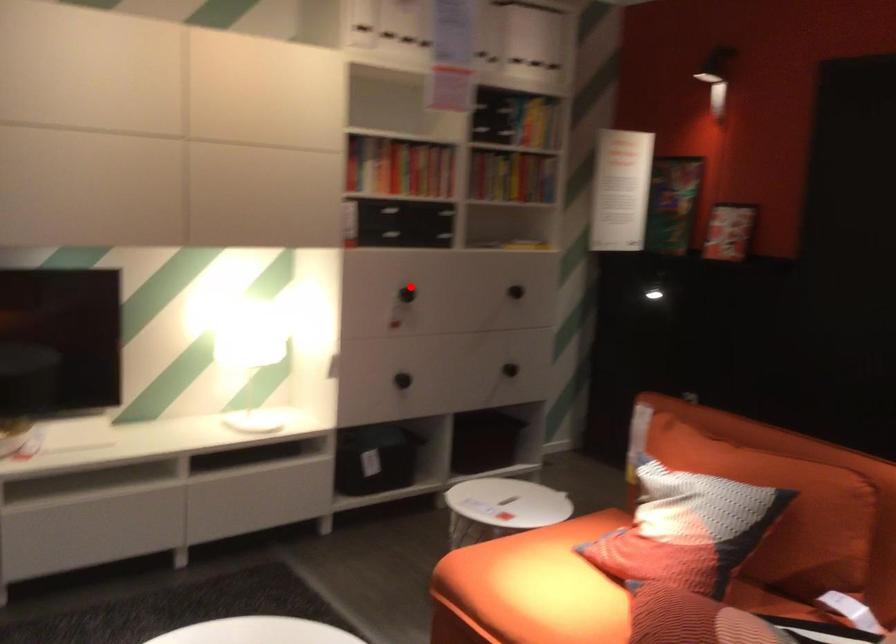
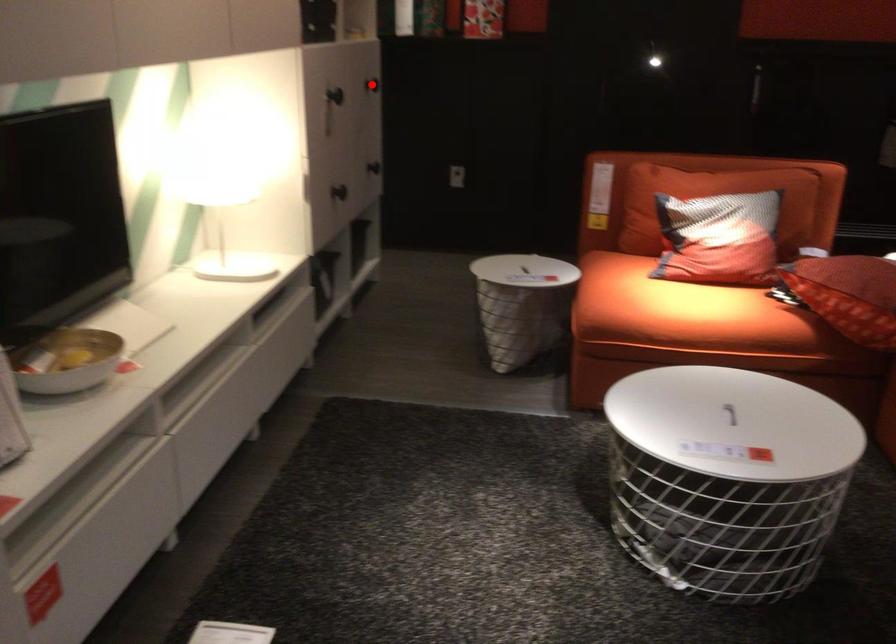
I am providing you with two images of the same scene from different viewpoints. A red point is marked on the first image and another point is marked on the second image. Does the point marked in image1 correspond to the same location as the one in image2?

No